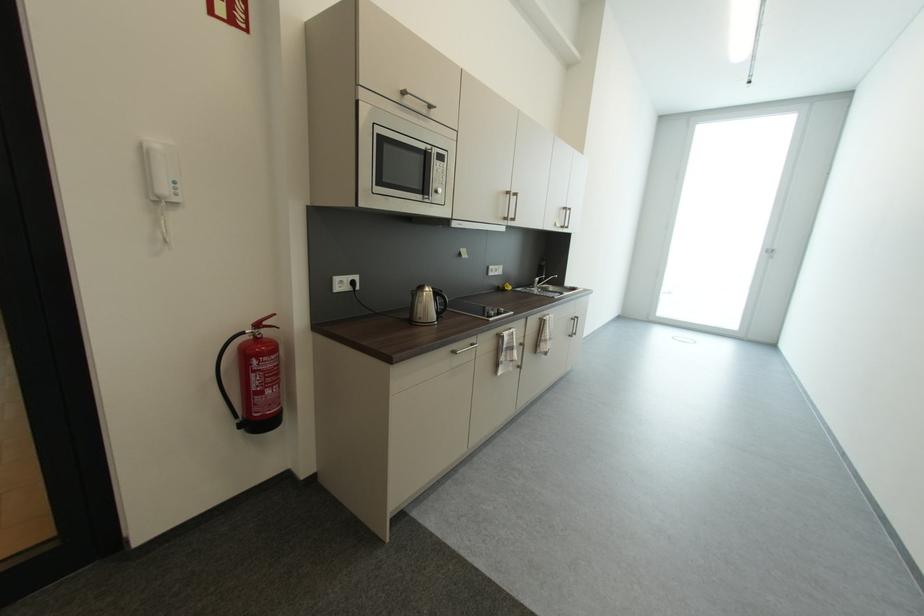
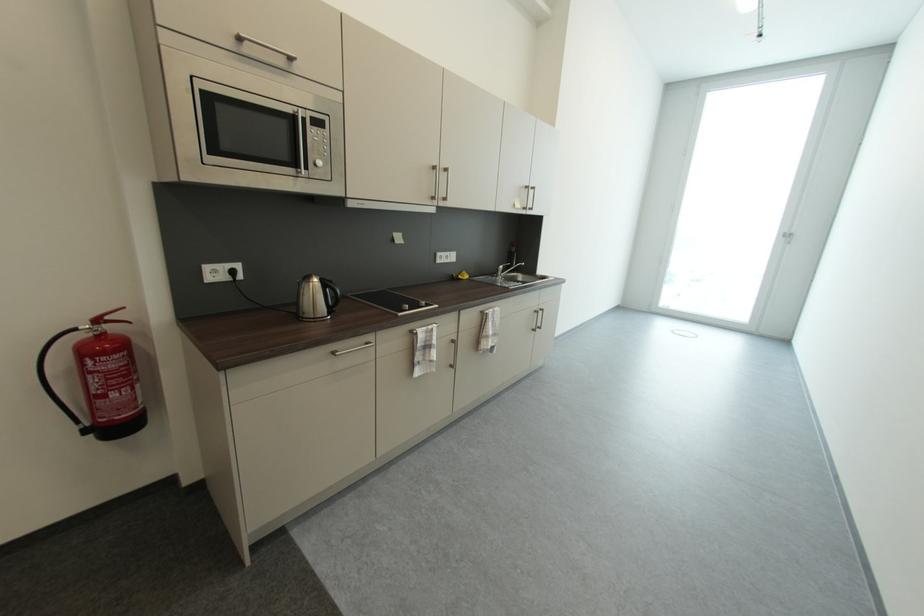
Find the pixel in the second image that matches [774,253] in the first image.

(794, 238)